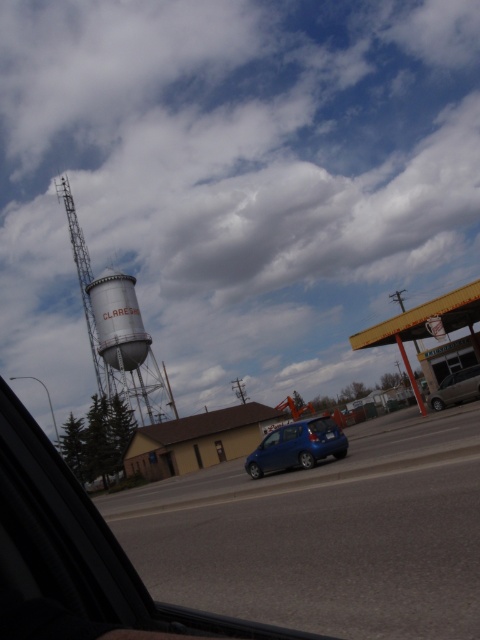
Question: Which point is farther from the camera taking this photo?

Choices:
 (A) (453, 396)
 (B) (256, 445)
 (C) (109, 358)

Answer: (C)

Question: Can you confirm if gray concrete water tower at center is positioned to the right of satin blue hatchback at center?

Choices:
 (A) yes
 (B) no

Answer: (B)

Question: Among these points, which one is farthest from the camera?

Choices:
 (A) (133, 317)
 (B) (456, 381)
 (C) (276, 464)

Answer: (A)

Question: Observing the image, what is the correct spatial positioning of gray concrete water tower at center in reference to metallic silver car at lower right?

Choices:
 (A) below
 (B) above

Answer: (B)

Question: Is satin blue hatchback at center bigger than metallic silver car at lower right?

Choices:
 (A) yes
 (B) no

Answer: (A)

Question: Which point appears farthest from the camera in this image?

Choices:
 (A) (140, 340)
 (B) (330, 449)

Answer: (A)